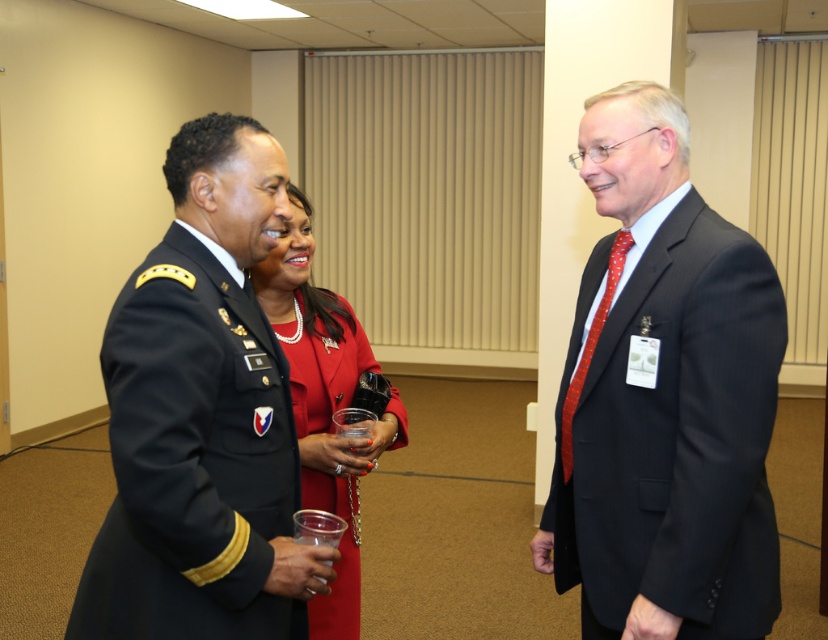
Question: Does shiny red coat at center appear on the right side of transparent plastic cup at center?

Choices:
 (A) yes
 (B) no

Answer: (B)

Question: Is shiny black uniform at center bigger than transparent plastic cup at center?

Choices:
 (A) no
 (B) yes

Answer: (B)

Question: Which of the following is the farthest from the observer?

Choices:
 (A) (335, 435)
 (B) (266, 244)
 (C) (325, 481)

Answer: (C)

Question: Is shiny black uniform at center smaller than transparent plastic cup at center?

Choices:
 (A) yes
 (B) no

Answer: (B)

Question: Which is farther from the transparent plastic cup at center?

Choices:
 (A) shiny black uniform at center
 (B) matte black suit at right

Answer: (B)

Question: Considering the real-world distances, which object is farthest from the shiny black uniform at center?

Choices:
 (A) shiny red coat at center
 (B) matte black suit at right

Answer: (B)